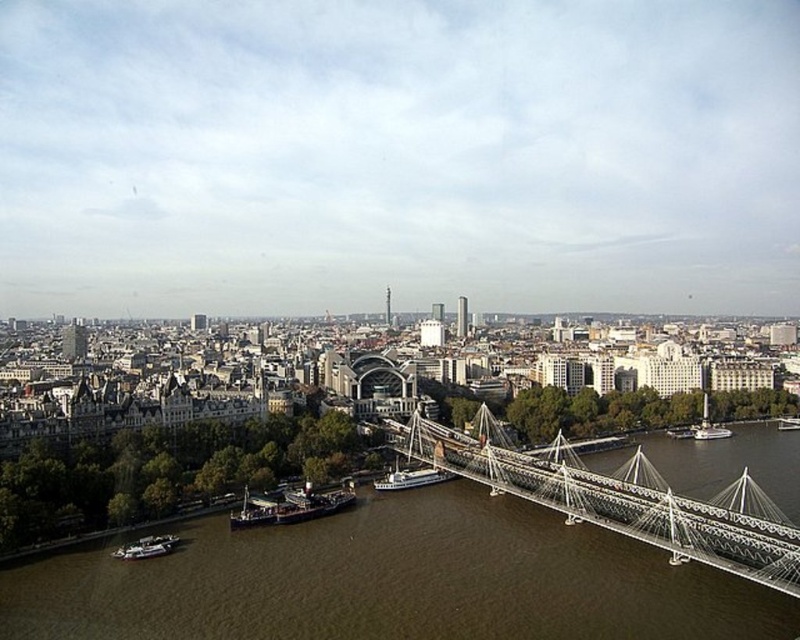
Question: Which object appears farthest from the camera in this image?

Choices:
 (A) brown water at center
 (B) white metallic suspension bridge at center-right
 (C) white wooden boat at center
 (D) metallic gray boat at lower left

Answer: (C)

Question: Which object is farther from the camera taking this photo?

Choices:
 (A) metallic silver boat at right
 (B) metallic gray boat at lower left
 (C) dark gray metallic ship at lower center
 (D) metallic silver tower at center

Answer: (D)

Question: Does white metallic suspension bridge at center-right have a smaller size compared to white wooden boat at center?

Choices:
 (A) no
 (B) yes

Answer: (A)

Question: Does white metallic suspension bridge at center-right have a larger size compared to metallic silver boat at right?

Choices:
 (A) no
 (B) yes

Answer: (B)

Question: Where is white metallic suspension bridge at center-right located in relation to metallic silver boat at right in the image?

Choices:
 (A) left
 (B) right

Answer: (A)

Question: Which is nearer to the white metallic suspension bridge at center-right?

Choices:
 (A) metallic silver boat at lower right
 (B) dark gray metallic ship at lower center

Answer: (B)